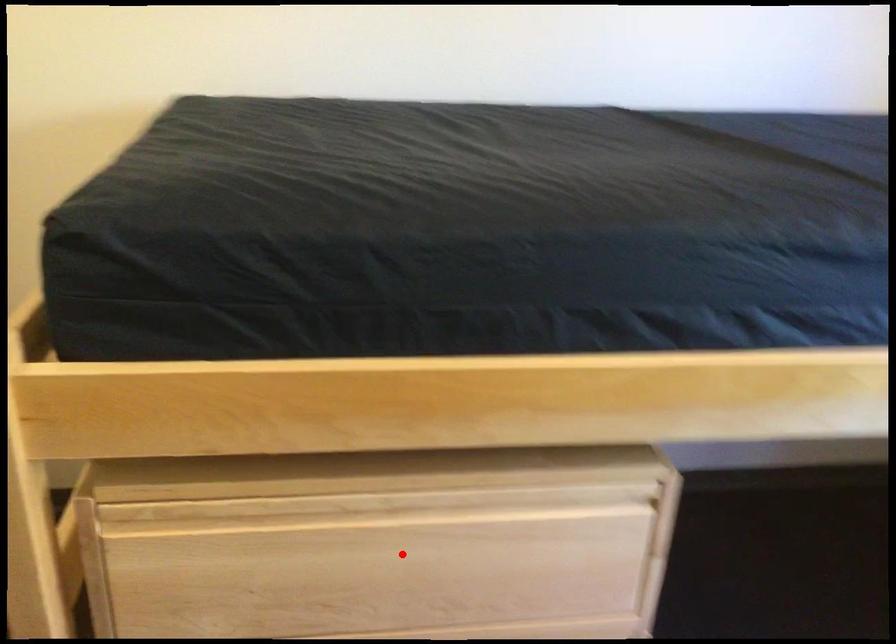
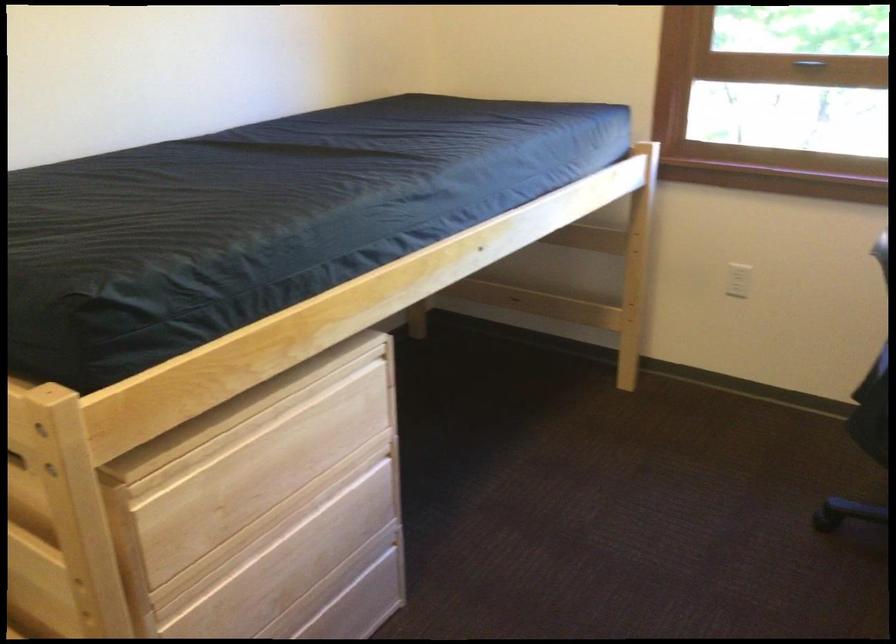
Find the pixel in the second image that matches the highlighted location in the first image.

(285, 448)